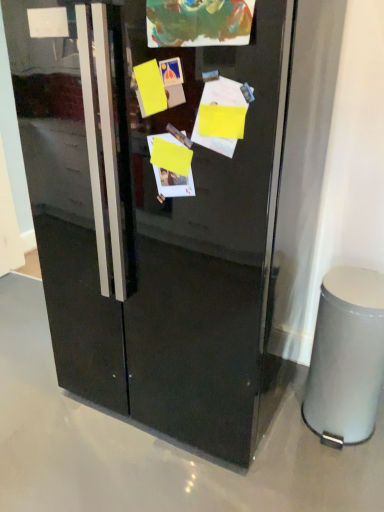
Question: Is silver metallic trash bin at lower right wider or thinner than glossy black refrigerator at center?

Choices:
 (A) wide
 (B) thin

Answer: (B)

Question: Does point (319, 292) appear closer or farther from the camera than point (41, 176)?

Choices:
 (A) closer
 (B) farther

Answer: (B)

Question: Is silver metallic trash bin at lower right spatially inside glossy black refrigerator at center, or outside of it?

Choices:
 (A) outside
 (B) inside

Answer: (A)

Question: Considering the positions of glossy black refrigerator at center and silver metallic trash bin at lower right in the image, is glossy black refrigerator at center wider or thinner than silver metallic trash bin at lower right?

Choices:
 (A) wide
 (B) thin

Answer: (A)

Question: Is glossy black refrigerator at center inside the boundaries of silver metallic trash bin at lower right, or outside?

Choices:
 (A) inside
 (B) outside

Answer: (B)

Question: Relative to silver metallic trash bin at lower right, is glossy black refrigerator at center in front or behind?

Choices:
 (A) front
 (B) behind

Answer: (A)

Question: In terms of size, does glossy black refrigerator at center appear bigger or smaller than silver metallic trash bin at lower right?

Choices:
 (A) small
 (B) big

Answer: (B)